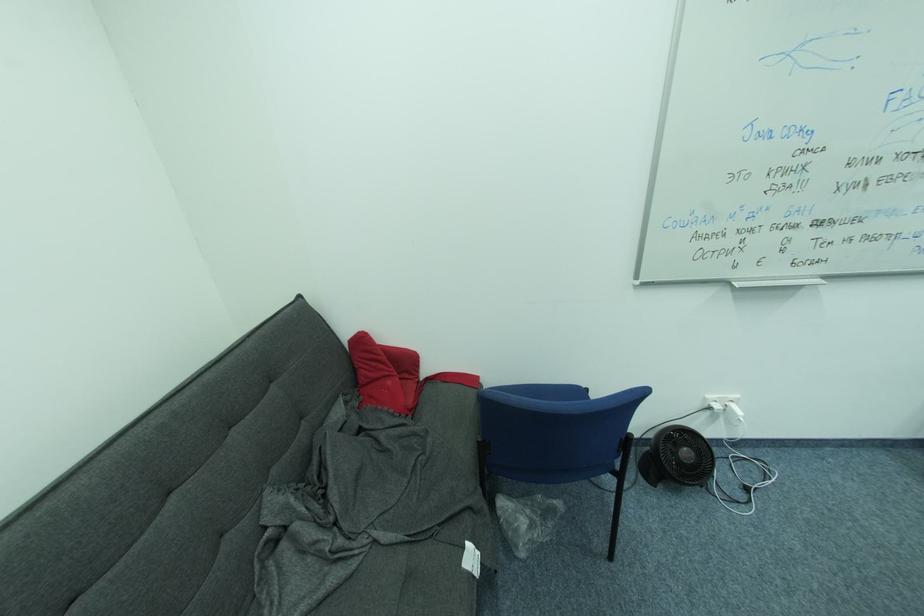
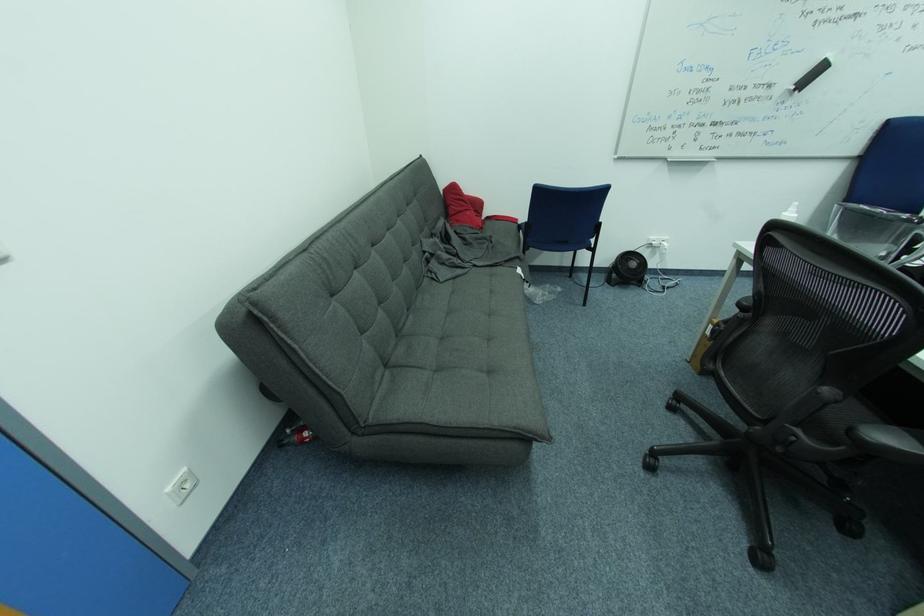
Find the pixel in the second image that matches (648,479) in the first image.

(613, 285)